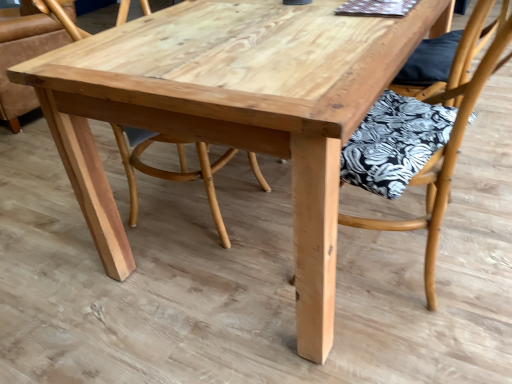
Question: Would you consider wooden chair with floral cushion at center, which ranks as the 2th chair in back-to-front order, to be distant from natural wood chair at center, which appears as the 2th chair when viewed from the right?

Choices:
 (A) yes
 (B) no

Answer: (A)

Question: Is wooden chair with floral cushion at center, the 1th chair from the front, positioned in front of natural wood chair at center, which ranks as the first chair in back-to-front order?

Choices:
 (A) yes
 (B) no

Answer: (A)

Question: Considering the relative sizes of wooden chair with floral cushion at center, the 1th chair from the front, and natural wood chair at center, which ranks as the first chair in back-to-front order, in the image provided, is wooden chair with floral cushion at center, the 1th chair from the front, thinner than natural wood chair at center, which ranks as the first chair in back-to-front order,?

Choices:
 (A) no
 (B) yes

Answer: (B)

Question: Does wooden chair with floral cushion at center, the 1th chair from the front, have a greater width compared to natural wood chair at center, which ranks as the first chair in back-to-front order?

Choices:
 (A) no
 (B) yes

Answer: (A)

Question: From the image's perspective, is wooden chair with floral cushion at center, which ranks as the 1th chair in right-to-left order, on top of natural wood chair at center, positioned as the first chair in left-to-right order?

Choices:
 (A) yes
 (B) no

Answer: (B)

Question: Can you confirm if wooden chair with floral cushion at center, which ranks as the 1th chair in right-to-left order, is smaller than natural wood chair at center, which ranks as the first chair in back-to-front order?

Choices:
 (A) no
 (B) yes

Answer: (B)

Question: Are natural wood chair at center, positioned as the first chair in left-to-right order, and wooden chair with floral cushion at center, which ranks as the 2th chair in back-to-front order, located far from each other?

Choices:
 (A) no
 (B) yes

Answer: (B)

Question: Can you confirm if natural wood chair at center, which is counted as the 2th chair, starting from the front, is smaller than wooden chair with floral cushion at center, placed as the second chair when sorted from left to right?

Choices:
 (A) yes
 (B) no

Answer: (B)

Question: Can you confirm if natural wood chair at center, positioned as the first chair in left-to-right order, is wider than wooden chair with floral cushion at center, which ranks as the 1th chair in right-to-left order?

Choices:
 (A) no
 (B) yes

Answer: (B)

Question: From the image's perspective, does natural wood chair at center, which appears as the 2th chair when viewed from the right, appear lower than wooden chair with floral cushion at center, placed as the second chair when sorted from left to right?

Choices:
 (A) yes
 (B) no

Answer: (B)

Question: Does natural wood chair at center, which appears as the 2th chair when viewed from the right, have a greater height compared to wooden chair with floral cushion at center, the 1th chair from the front?

Choices:
 (A) yes
 (B) no

Answer: (B)

Question: Is the position of natural wood chair at center, which ranks as the first chair in back-to-front order, more distant than that of wooden chair with floral cushion at center, placed as the second chair when sorted from left to right?

Choices:
 (A) no
 (B) yes

Answer: (B)

Question: Is natural wood chair at center, which appears as the 2th chair when viewed from the right, bigger or smaller than wooden chair with floral cushion at center, the 1th chair from the front?

Choices:
 (A) small
 (B) big

Answer: (B)